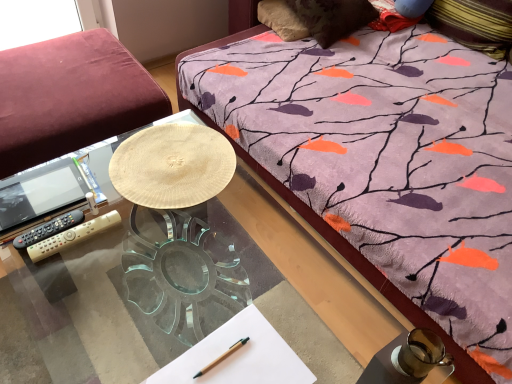
Question: Considering the relative sizes of purple fabric pillow at upper right, which ranks as the 1th pillow in right-to-left order, and white paper at center in the image provided, is purple fabric pillow at upper right, which ranks as the 1th pillow in right-to-left order, thinner than white paper at center?

Choices:
 (A) no
 (B) yes

Answer: (A)

Question: Considering the relative sizes of purple fabric pillow at upper right, the 2th pillow viewed from the left, and white paper at center in the image provided, is purple fabric pillow at upper right, the 2th pillow viewed from the left, bigger than white paper at center?

Choices:
 (A) yes
 (B) no

Answer: (A)

Question: Is purple fabric pillow at upper right, the 2th pillow viewed from the left, located outside white paper at center?

Choices:
 (A) no
 (B) yes

Answer: (B)

Question: Does purple fabric pillow at upper right, which ranks as the 1th pillow in right-to-left order, appear on the right side of white paper at center?

Choices:
 (A) yes
 (B) no

Answer: (A)

Question: Is white paper at center inside purple fabric pillow at upper right, the 2th pillow viewed from the left?

Choices:
 (A) yes
 (B) no

Answer: (B)

Question: Could you tell me if purple fabric pillow at upper right, which ranks as the 1th pillow in right-to-left order, is turned towards white paper at center?

Choices:
 (A) no
 (B) yes

Answer: (B)

Question: Is suede-like brown pillow at upper center, which is the 2th pillow from right to left, next to wooden pen at lower center?

Choices:
 (A) no
 (B) yes

Answer: (A)

Question: From the image's perspective, is suede-like brown pillow at upper center, which is the 2th pillow from right to left, over wooden pen at lower center?

Choices:
 (A) no
 (B) yes

Answer: (B)

Question: Is suede-like brown pillow at upper center, the 1th pillow in the left-to-right sequence, outside of wooden pen at lower center?

Choices:
 (A) yes
 (B) no

Answer: (A)

Question: From a real-world perspective, is suede-like brown pillow at upper center, which is the 2th pillow from right to left, physically above wooden pen at lower center?

Choices:
 (A) yes
 (B) no

Answer: (B)

Question: Is suede-like brown pillow at upper center, which is the 2th pillow from right to left, taller than wooden pen at lower center?

Choices:
 (A) yes
 (B) no

Answer: (A)

Question: Considering the relative positions of suede-like brown pillow at upper center, the 1th pillow in the left-to-right sequence, and wooden pen at lower center in the image provided, is suede-like brown pillow at upper center, the 1th pillow in the left-to-right sequence, behind wooden pen at lower center?

Choices:
 (A) yes
 (B) no

Answer: (A)

Question: From a real-world perspective, is velvet burgundy studio couch at left beneath transparent glass desk at center?

Choices:
 (A) no
 (B) yes

Answer: (A)